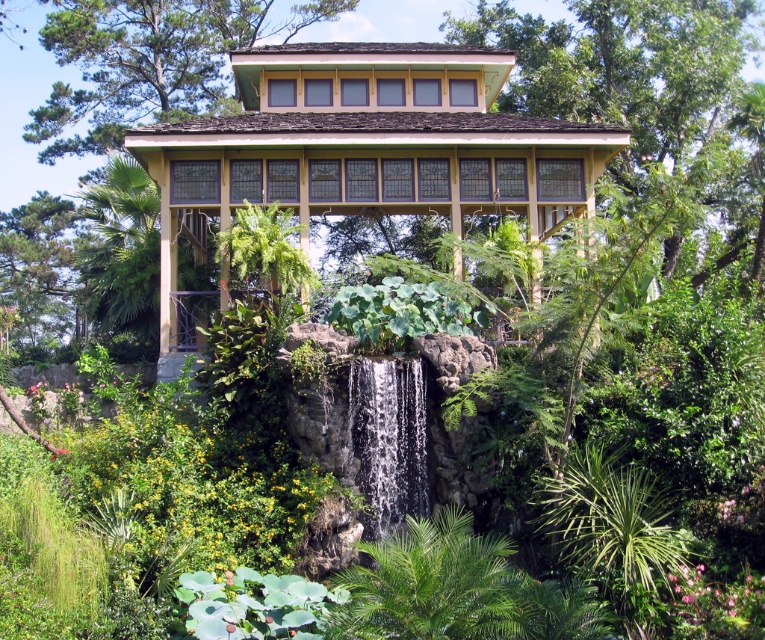
How much distance is there between green leafy tree at upper center and clear water at center?

green leafy tree at upper center is 33.74 meters from clear water at center.

In the scene shown: Who is positioned more to the right, green leafy tree at upper center or clear water at center?

From the viewer's perspective, clear water at center appears more on the right side.

Image resolution: width=765 pixels, height=640 pixels. Describe the element at coordinates (148, 61) in the screenshot. I see `green leafy tree at upper center` at that location.

Find the location of a particular element. green leafy tree at upper center is located at coordinates (148, 61).

Does point (448, 157) lie behind point (57, 109)?

No, (448, 157) is closer to viewer.

Where is `yellow wood gazebo at center`? yellow wood gazebo at center is located at coordinates (363, 148).

Can you confirm if green leafy tree at center is positioned below clear water at center?

Actually, green leafy tree at center is above clear water at center.

Who is more distant from viewer, (741, 221) or (392, 483)?

Point (741, 221)

Identify the location of green leafy tree at center. (635, 81).